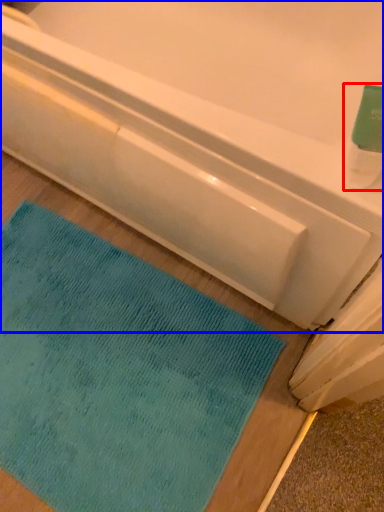
Question: Among these objects, which one is farthest to the camera, cleaning product (highlighted by a red box) or bathtub (highlighted by a blue box)?

Choices:
 (A) cleaning product
 (B) bathtub

Answer: (B)